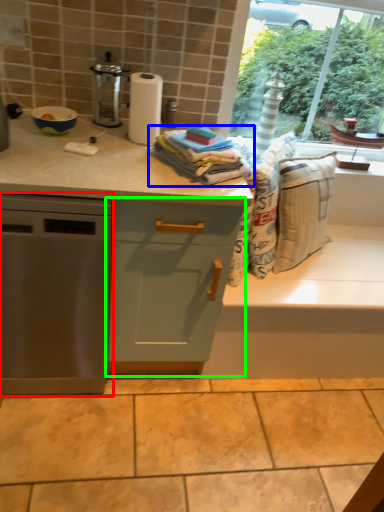
Question: Based on their relative distances, which object is nearer to home appliance (highlighted by a red box)? Choose from blanket (highlighted by a blue box) and cabinetry (highlighted by a green box).

Choices:
 (A) blanket
 (B) cabinetry

Answer: (B)